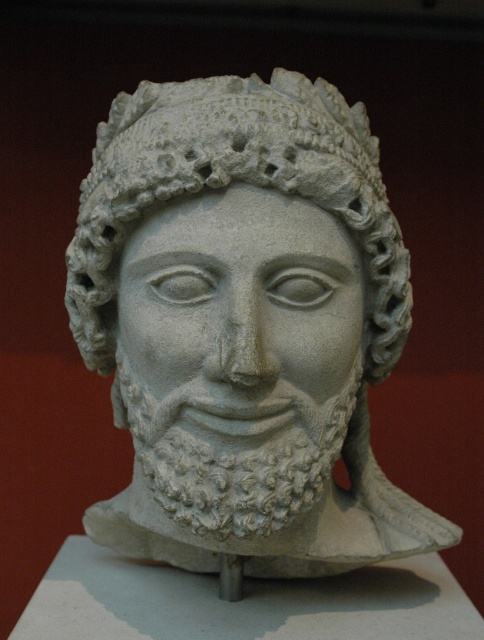
Is white stone bust at center behind white stone face at center?

Yes.

Is white stone bust at center positioned in front of white stone face at center?

No, it is behind white stone face at center.

In order to click on white stone bust at center in this screenshot , I will do `click(244, 324)`.

Identify the location of white stone bust at center. (244, 324).